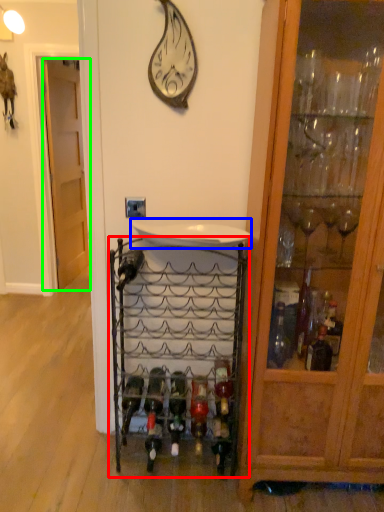
Question: Which is farther away from shelf (highlighted by a red box)? sink (highlighted by a blue box) or door (highlighted by a green box)?

Choices:
 (A) sink
 (B) door

Answer: (B)